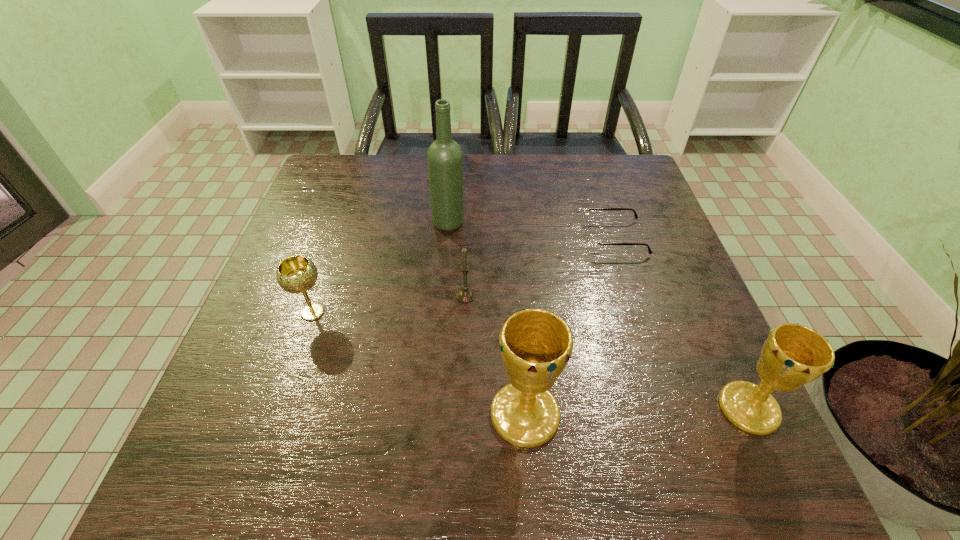
The image size is (960, 540). Identify the location of free region that satisfies the following two spatial constraints: 1. on the back side of the rightmost object; 2. at the hinge ends of the spectacles. (671, 238).

Identify the location of blank space that satisfies the following two spatial constraints: 1. on the back side of the candle; 2. on the left side of the leftmost object. (319, 295).

Identify the location of vacant space that satisfies the following two spatial constraints: 1. on the back side of the tallest chalice; 2. on the left side of the second shortest chalice. (524, 408).

The height and width of the screenshot is (540, 960). Find the location of `vacant position in the image that satisfies the following two spatial constraints: 1. on the back side of the rightmost chalice; 2. at the hinge ends of the fifth object from left to right`. vacant position in the image that satisfies the following two spatial constraints: 1. on the back side of the rightmost chalice; 2. at the hinge ends of the fifth object from left to right is located at coordinates (671, 238).